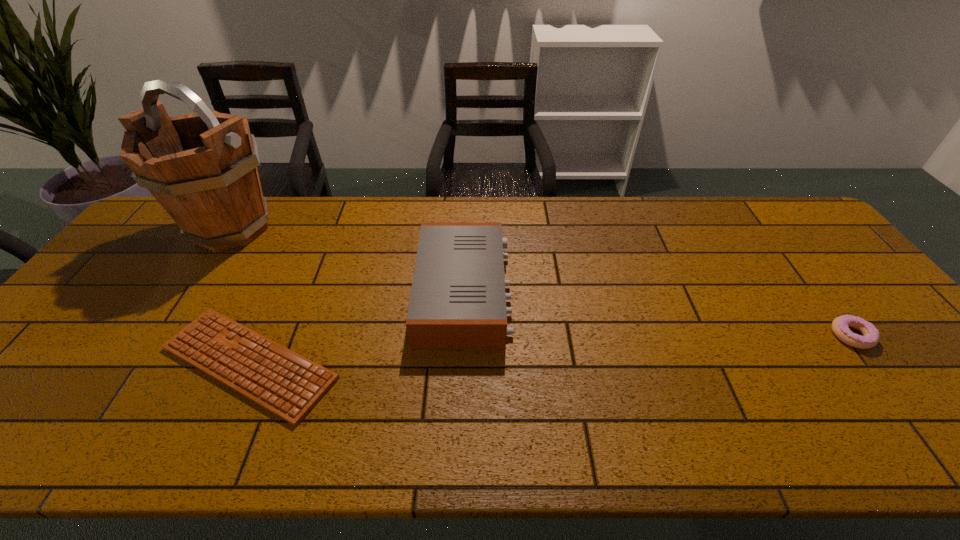
Locate an element on the screen. the tallest object is located at coordinates (x=202, y=168).

The image size is (960, 540). In order to click on the third object from left to right in this screenshot , I will do `click(458, 302)`.

Where is `radio receiver`? This screenshot has height=540, width=960. radio receiver is located at coordinates (458, 302).

The height and width of the screenshot is (540, 960). I want to click on doughnut, so click(x=840, y=326).

Locate an element on the screen. the rightmost object is located at coordinates (840, 326).

At what (x,y) coordinates should I click in order to perform the action: click on the shortest object. Please return your answer as a coordinate pair (x, y). Looking at the image, I should click on (289, 385).

Identify the location of free spot located 0.080m on the left of the bucket. (156, 228).

The width and height of the screenshot is (960, 540). In order to click on free space located 0.370m on the control panel of the radio receiver in this screenshot , I will do `click(643, 293)`.

Identify the location of free region located on the left of the doughnut. Image resolution: width=960 pixels, height=540 pixels. (693, 335).

Find the location of a particular element. vacant space located 0.270m on the left of the computer keyboard is located at coordinates (42, 363).